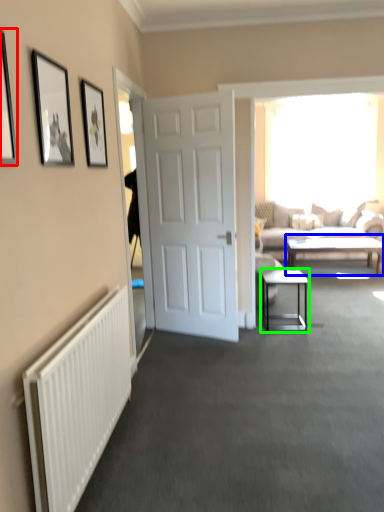
Question: Which is farther away from picture frame (highlighted by a red box)? coffee table (highlighted by a blue box) or table (highlighted by a green box)?

Choices:
 (A) coffee table
 (B) table

Answer: (A)